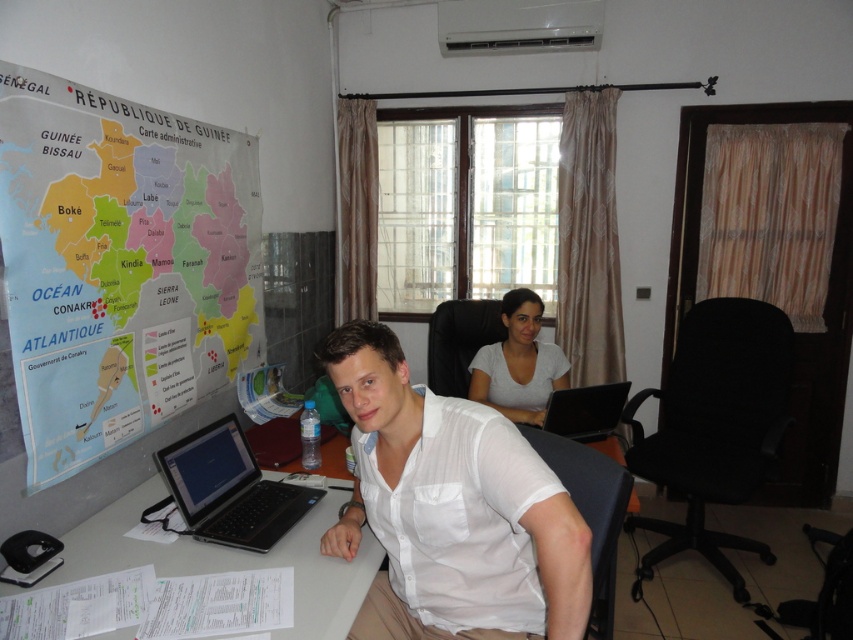
You are organizing a small conference in the office and need to place a 4 feet long tablecloth on the white plastic computer desk at center. Considering the space between the desk and the black glossy laptop at center, will the tablecloth fit without overlapping the laptop?

The distance between the white plastic computer desk at center and the black glossy laptop at center is 3.30 feet. Since the tablecloth is 4 feet long, it will overlap the laptop by 0.70 feet.